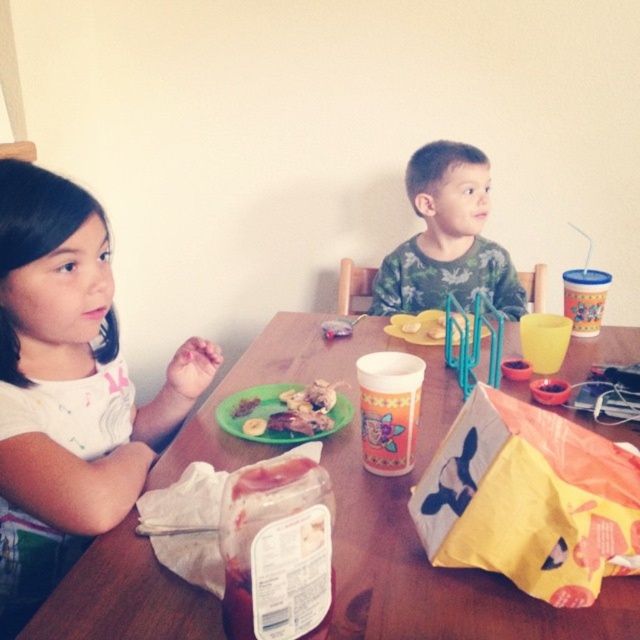
Question: Among these points, which one is nearest to the camera?

Choices:
 (A) (234, 404)
 (B) (387, 310)
 (C) (561, 620)

Answer: (C)

Question: Which object is the farthest from the smooth plastic plate with food at center?

Choices:
 (A) white matte shirt at left
 (B) yellow matte banana at left
 (C) camouflage-patterned shirt at center

Answer: (C)

Question: Which object is farther from the camera taking this photo?

Choices:
 (A) yellow matte banana at left
 (B) white matte shirt at left

Answer: (A)

Question: Does camouflage-patterned shirt at center lie behind smooth plastic plate with food at center?

Choices:
 (A) no
 (B) yes

Answer: (B)

Question: Is the position of wooden table at center less distant than that of white matte shirt at left?

Choices:
 (A) no
 (B) yes

Answer: (B)

Question: Does wooden table at center come behind camouflage-patterned shirt at center?

Choices:
 (A) yes
 (B) no

Answer: (B)